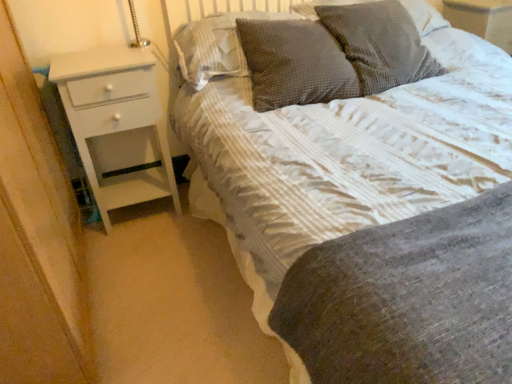
Describe the element at coordinates (115, 118) in the screenshot. I see `white glossy chest of drawers at left` at that location.

Identify the location of dark grey textured pillow at upper center, positioned as the third pillow in right-to-left order. The width and height of the screenshot is (512, 384). (295, 64).

What do you see at coordinates (379, 43) in the screenshot? I see `woven fabric pillow at upper center, positioned as the 3th pillow in left-to-right order` at bounding box center [379, 43].

Identify the location of white glossy chest of drawers at left. The width and height of the screenshot is (512, 384). (115, 118).

Does dark grey textured pillow at upper center, placed as the second pillow when sorted from left to right, turn towards woven fabric pillow at upper center, positioned as the 3th pillow in left-to-right order?

No, dark grey textured pillow at upper center, placed as the second pillow when sorted from left to right, does not turn towards woven fabric pillow at upper center, positioned as the 3th pillow in left-to-right order.

Which is in front, dark grey textured pillow at upper center, placed as the second pillow when sorted from left to right, or woven fabric pillow at upper center, which is the second pillow from right to left?

Positioned in front is dark grey textured pillow at upper center, placed as the second pillow when sorted from left to right.

From the dark grey textured pillow at upper center, placed as the second pillow when sorted from left to right, count 1st pillows backward and point to it. Please provide its 2D coordinates.

[(379, 43)]

Would you say dark grey textured pillow at upper center, placed as the second pillow when sorted from left to right, is outside woven fabric pillow at upper center, positioned as the 3th pillow in left-to-right order?

Yes, dark grey textured pillow at upper center, placed as the second pillow when sorted from left to right, is located beyond the bounds of woven fabric pillow at upper center, positioned as the 3th pillow in left-to-right order.

From the image's perspective, is woven fabric pillow at upper center, positioned as the 3th pillow in left-to-right order, above or below waffle-textured gray pillow at upper center, acting as the 1th pillow starting from the left?

Based on their image positions, woven fabric pillow at upper center, positioned as the 3th pillow in left-to-right order, is located beneath waffle-textured gray pillow at upper center, acting as the 1th pillow starting from the left.

Is waffle-textured gray pillow at upper center, acting as the 1th pillow starting from the left, completely or partially inside woven fabric pillow at upper center, positioned as the 3th pillow in left-to-right order?

Definitely not — waffle-textured gray pillow at upper center, acting as the 1th pillow starting from the left, is not inside woven fabric pillow at upper center, positioned as the 3th pillow in left-to-right order.

Is woven fabric pillow at upper center, positioned as the 3th pillow in left-to-right order, far away from waffle-textured gray pillow at upper center, marked as the 4th pillow in a right-to-left arrangement?

They are positioned close to each other.

Is woven fabric pillow at upper center, which is the second pillow from right to left, bigger or smaller than waffle-textured gray pillow at upper center, marked as the 4th pillow in a right-to-left arrangement?

Considering their sizes, woven fabric pillow at upper center, which is the second pillow from right to left, takes up more space than waffle-textured gray pillow at upper center, marked as the 4th pillow in a right-to-left arrangement.

In the scene shown: Is woven fabric pillow at upper center, which is the second pillow from right to left, taller than white glossy chest of drawers at left?

No, woven fabric pillow at upper center, which is the second pillow from right to left, is not taller than white glossy chest of drawers at left.

Could you tell me if woven fabric pillow at upper center, positioned as the 3th pillow in left-to-right order, is facing white glossy chest of drawers at left?

No, woven fabric pillow at upper center, positioned as the 3th pillow in left-to-right order, is not oriented towards white glossy chest of drawers at left.

From the image's perspective, between woven fabric pillow at upper center, which is the second pillow from right to left, and white glossy chest of drawers at left, which one is located above?

woven fabric pillow at upper center, which is the second pillow from right to left, from the image's perspective.

How much distance is there between woven fabric pillow at upper center, positioned as the 3th pillow in left-to-right order, and white glossy chest of drawers at left?

They are 38.91 inches apart.

From the image's perspective, which one is positioned higher, white textured bed at center or waffle-textured gray pillow at upper center, acting as the 1th pillow starting from the left?

From the image's view, waffle-textured gray pillow at upper center, acting as the 1th pillow starting from the left, is above.

Looking at their sizes, would you say white textured bed at center is wider or thinner than waffle-textured gray pillow at upper center, marked as the 4th pillow in a right-to-left arrangement?

In the image, white textured bed at center appears to be wider than waffle-textured gray pillow at upper center, marked as the 4th pillow in a right-to-left arrangement.

How many degrees apart are the facing directions of white textured bed at center and waffle-textured gray pillow at upper center, marked as the 4th pillow in a right-to-left arrangement?

There is a 1.51-degree angle between the facing directions of white textured bed at center and waffle-textured gray pillow at upper center, marked as the 4th pillow in a right-to-left arrangement.

Consider the image. Is waffle-textured gray pillow at upper center, acting as the 1th pillow starting from the left, located within white textured bed at center?

Yes, white textured bed at center is surrounding waffle-textured gray pillow at upper center, acting as the 1th pillow starting from the left.

Is woven fabric pillow at upper center, marked as the first pillow in a right-to-left arrangement, closer to the viewer compared to woven fabric pillow at upper center, positioned as the 3th pillow in left-to-right order?

That is False.

Is point (426, 11) in front of point (379, 4)?

No, it is not.

Which of these two, woven fabric pillow at upper center, marked as the first pillow in a right-to-left arrangement, or woven fabric pillow at upper center, which is the second pillow from right to left, stands taller?

With more height is woven fabric pillow at upper center, which is the second pillow from right to left.

From the picture: From a real-world perspective, is woven fabric pillow at upper center, marked as the first pillow in a right-to-left arrangement, positioned over woven fabric pillow at upper center, positioned as the 3th pillow in left-to-right order, based on gravity?

Yes, from a real-world perspective, woven fabric pillow at upper center, marked as the first pillow in a right-to-left arrangement, is above woven fabric pillow at upper center, positioned as the 3th pillow in left-to-right order.

The height and width of the screenshot is (384, 512). I want to click on pillow that is the 3rd one when counting upward from the white glossy chest of drawers at left (from the image's perspective), so click(216, 46).

Which point is more distant from viewer, (x=224, y=27) or (x=170, y=186)?

The point (x=170, y=186) is farther from the camera.

From the image's perspective, is waffle-textured gray pillow at upper center, acting as the 1th pillow starting from the left, on white glossy chest of drawers at left?

Indeed, from the image's perspective, waffle-textured gray pillow at upper center, acting as the 1th pillow starting from the left, is shown above white glossy chest of drawers at left.

Where is `the 2nd pillow in front of the white glossy chest of drawers at left, starting your count from the anchor`? the 2nd pillow in front of the white glossy chest of drawers at left, starting your count from the anchor is located at coordinates (295, 64).

Between dark grey textured pillow at upper center, positioned as the third pillow in right-to-left order, and white glossy chest of drawers at left, which one has larger size?

white glossy chest of drawers at left is bigger.

From the image's perspective, is dark grey textured pillow at upper center, positioned as the third pillow in right-to-left order, beneath white glossy chest of drawers at left?

No, from the image's perspective, dark grey textured pillow at upper center, positioned as the third pillow in right-to-left order, is not below white glossy chest of drawers at left.

You are a GUI agent. You are given a task and a screenshot of the screen. Output one action in this format:
    pyautogui.click(x=<x>, y=<y>)
    Task: Click on the pillow in front of the woven fabric pillow at upper center, which is the second pillow from right to left
    The height and width of the screenshot is (384, 512).
    Given the screenshot: What is the action you would take?
    pyautogui.click(x=295, y=64)

At what (x,y) coordinates should I click in order to perform the action: click on pillow that is the 1st one when counting downward from the waffle-textured gray pillow at upper center, acting as the 1th pillow starting from the left (from the image's perspective). Please return your answer as a coordinate pair (x, y). The width and height of the screenshot is (512, 384). Looking at the image, I should click on (379, 43).

Looking at the image, which one is located closer to woven fabric pillow at upper center, positioned as the 3th pillow in left-to-right order, woven fabric pillow at upper center, marked as the first pillow in a right-to-left arrangement, or waffle-textured gray pillow at upper center, marked as the 4th pillow in a right-to-left arrangement?

woven fabric pillow at upper center, marked as the first pillow in a right-to-left arrangement, is closer to woven fabric pillow at upper center, positioned as the 3th pillow in left-to-right order.

When comparing their distances from white textured bed at center, does dark grey textured pillow at upper center, placed as the second pillow when sorted from left to right, or woven fabric pillow at upper center, positioned as the 3th pillow in left-to-right order, seem further?

woven fabric pillow at upper center, positioned as the 3th pillow in left-to-right order, is positioned further to the anchor white textured bed at center.

Estimate the real-world distances between objects in this image. Which object is closer to woven fabric pillow at upper center, positioned as the 3th pillow in left-to-right order, dark grey textured pillow at upper center, positioned as the third pillow in right-to-left order, or woven fabric pillow at upper center, the 4th pillow in the left-to-right sequence?

dark grey textured pillow at upper center, positioned as the third pillow in right-to-left order, lies closer to woven fabric pillow at upper center, positioned as the 3th pillow in left-to-right order, than the other object.

When comparing their distances from woven fabric pillow at upper center, positioned as the 3th pillow in left-to-right order, does dark grey textured pillow at upper center, positioned as the third pillow in right-to-left order, or white glossy chest of drawers at left seem further?

white glossy chest of drawers at left.

Looking at the image, which one is located closer to dark grey textured pillow at upper center, placed as the second pillow when sorted from left to right, waffle-textured gray pillow at upper center, marked as the 4th pillow in a right-to-left arrangement, or white glossy chest of drawers at left?

waffle-textured gray pillow at upper center, marked as the 4th pillow in a right-to-left arrangement, is closer to dark grey textured pillow at upper center, placed as the second pillow when sorted from left to right.

In the scene shown: Estimate the real-world distances between objects in this image. Which object is further from woven fabric pillow at upper center, marked as the first pillow in a right-to-left arrangement, dark grey textured pillow at upper center, placed as the second pillow when sorted from left to right, or woven fabric pillow at upper center, which is the second pillow from right to left?

dark grey textured pillow at upper center, placed as the second pillow when sorted from left to right, is further to woven fabric pillow at upper center, marked as the first pillow in a right-to-left arrangement.

Based on their spatial positions, is dark grey textured pillow at upper center, positioned as the third pillow in right-to-left order, or waffle-textured gray pillow at upper center, acting as the 1th pillow starting from the left, closer to woven fabric pillow at upper center, positioned as the 3th pillow in left-to-right order?

Among the two, dark grey textured pillow at upper center, positioned as the third pillow in right-to-left order, is located nearer to woven fabric pillow at upper center, positioned as the 3th pillow in left-to-right order.

Considering their positions, is white glossy chest of drawers at left positioned further to woven fabric pillow at upper center, marked as the first pillow in a right-to-left arrangement, than dark grey textured pillow at upper center, placed as the second pillow when sorted from left to right?

white glossy chest of drawers at left is further to woven fabric pillow at upper center, marked as the first pillow in a right-to-left arrangement.

Identify the location of pillow between dark grey textured pillow at upper center, placed as the second pillow when sorted from left to right, and woven fabric pillow at upper center, marked as the first pillow in a right-to-left arrangement, in the horizontal direction. (379, 43).

This screenshot has height=384, width=512. I want to click on pillow between waffle-textured gray pillow at upper center, acting as the 1th pillow starting from the left, and woven fabric pillow at upper center, which is the second pillow from right to left, in the horizontal direction, so pyautogui.click(x=295, y=64).

Identify the location of the chest of drawers positioned between white textured bed at center and waffle-textured gray pillow at upper center, acting as the 1th pillow starting from the left, from near to far. (115, 118).

Locate an element on the screen. chest of drawers between white textured bed at center and woven fabric pillow at upper center, the 4th pillow in the left-to-right sequence, from front to back is located at coordinates [115, 118].